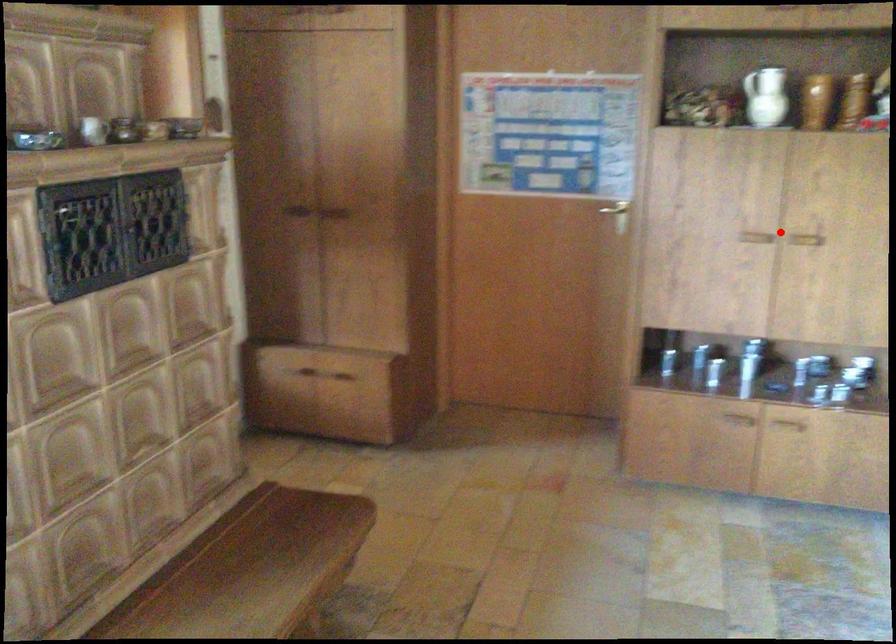
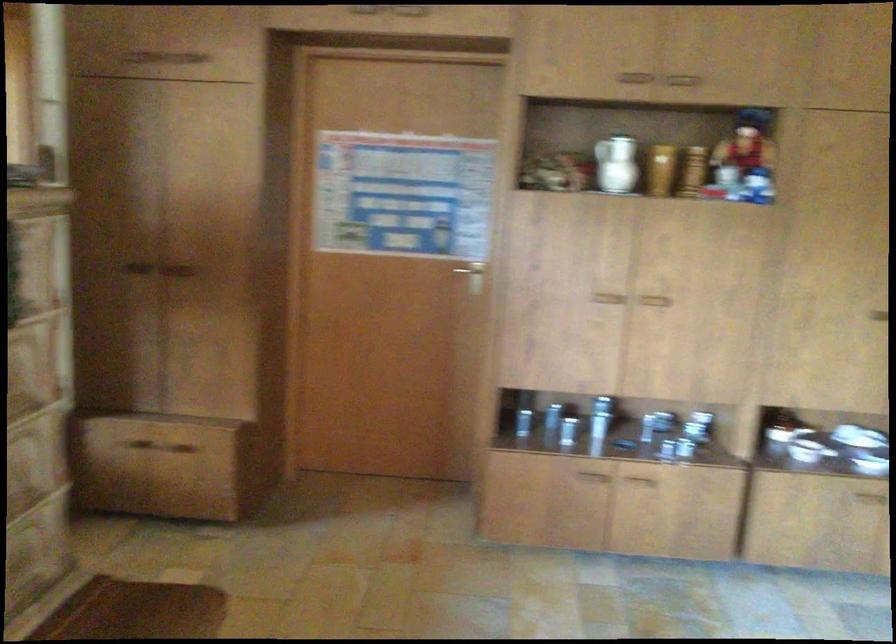
Find the pixel in the second image that matches the highlighted location in the first image.

(633, 295)